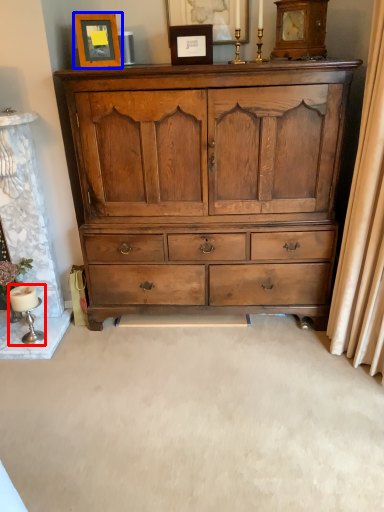
Question: Which object appears farthest to the camera in this image, table lamp (highlighted by a red box) or picture frame (highlighted by a blue box)?

Choices:
 (A) table lamp
 (B) picture frame

Answer: (A)